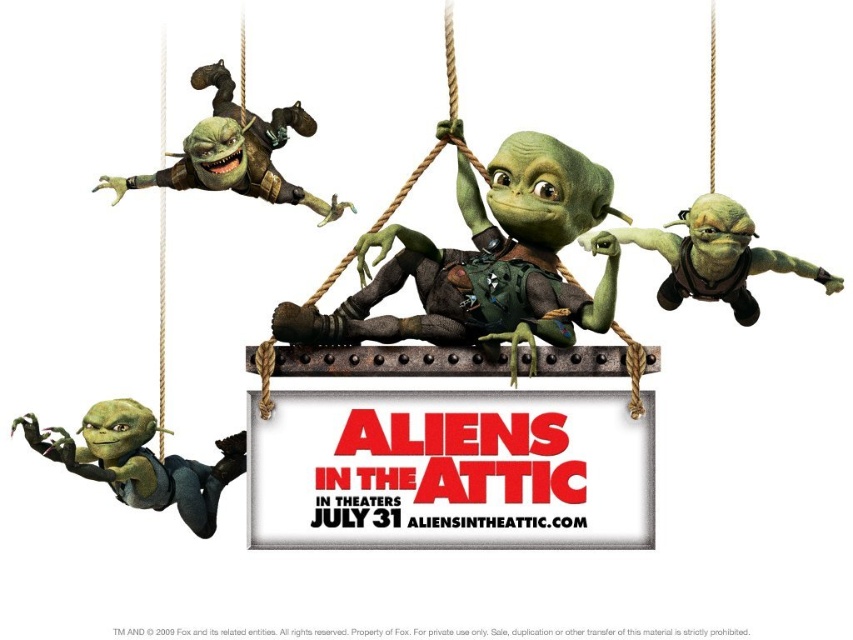
Can you confirm if white cardboard sign at center is positioned above green matte alien at right?

No.

Between white cardboard sign at center and green matte alien at right, which one has less height?

white cardboard sign at center

Who is more distant from viewer, (352,499) or (726,236)?

Positioned behind is point (726,236).

Locate an element on the screen. Image resolution: width=853 pixels, height=640 pixels. white cardboard sign at center is located at coordinates (450, 470).

Who is more forward, [59,429] or [129,179]?

Point [59,429]

Does point (135, 477) come behind point (201, 132)?

No, (135, 477) is closer to viewer.

Where is `green matte alien at lower left`? The width and height of the screenshot is (853, 640). green matte alien at lower left is located at coordinates (140, 461).

Is white cardboard sign at center shorter than matte green alien at center?

Yes.

Is point (271, 496) farther from viewer compared to point (492, 280)?

No, it is in front of (492, 280).

Find the location of a particular element. white cardboard sign at center is located at coordinates (450, 470).